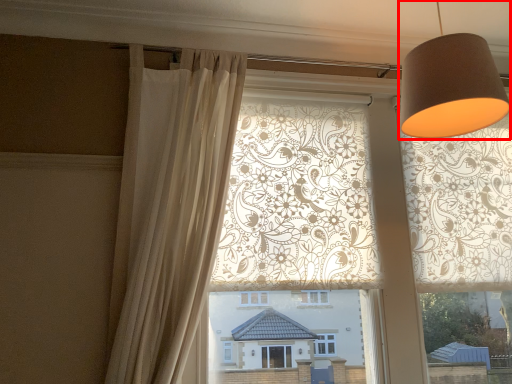
Question: Where is table lamp (annotated by the red box) located in relation to curtain in the image?

Choices:
 (A) right
 (B) left

Answer: (A)